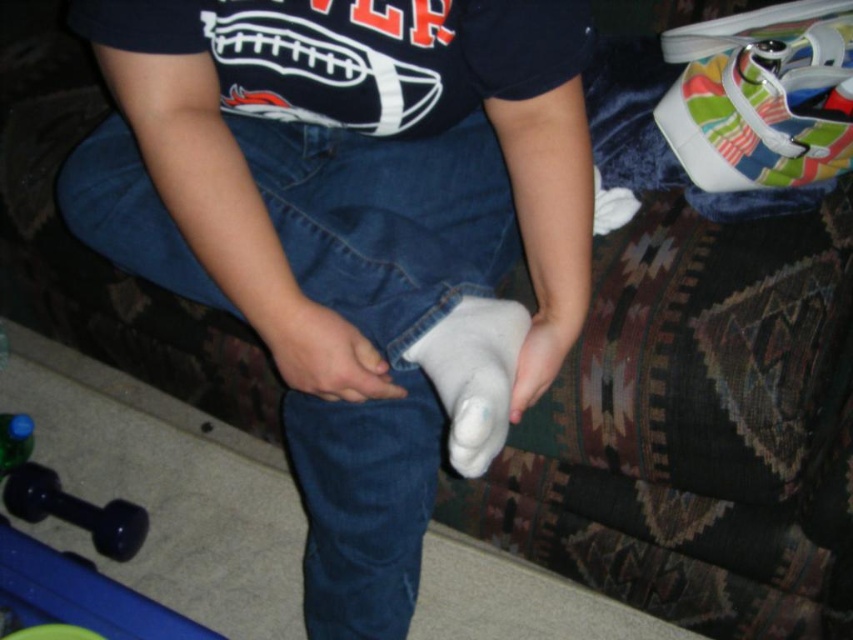
You are a physical therapist observing a patient in their home. You notice the white matte bandage at center and the rubberized black dumbbell at lower left. Which object is positioned higher in the image?

The white matte bandage at center is above the rubberized black dumbbell at lower left, so it is positioned higher in the image.

You are a physical therapist observing a patient in a rehabilitation session. The patient is sitting on a couch and has two white objects in front of them. One is a bandage and the other is their hand. Based on the scene, which object is closer to you, the therapist, the white matte bandage at center or the white matte hand at center?

The white matte hand at center is behind the white matte bandage at center, so the white matte bandage at center is closer to you.

You are a physical therapist observing a patient in a living room. You notice the white matte bandage at center and the rubberized black dumbbell at lower left. Which object is positioned closer to the patient?

The white matte bandage at center is closer to the viewer than the rubberized black dumbbell at lower left, so the bandage is closer to the patient.